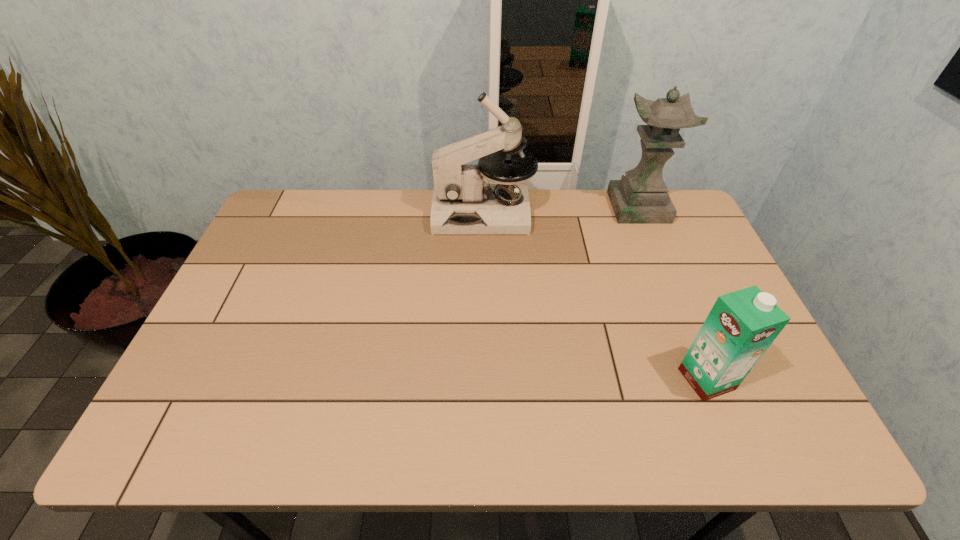
The height and width of the screenshot is (540, 960). Find the location of `vacant area at the near right corner of the desktop`. vacant area at the near right corner of the desktop is located at coordinates (731, 423).

Identify the location of free space between the leftmost object and the shortest object. point(595,296).

Image resolution: width=960 pixels, height=540 pixels. I want to click on vacant space that's between the leftmost object and the shortest object, so click(595, 296).

Locate an element on the screen. This screenshot has height=540, width=960. free point between the sculpture and the shortest object is located at coordinates (672, 293).

Where is `empty space between the nearest object and the sculpture`? The image size is (960, 540). empty space between the nearest object and the sculpture is located at coordinates coord(672,293).

This screenshot has width=960, height=540. What are the coordinates of `vacant area that lies between the sculpture and the carton` in the screenshot? It's located at (672, 293).

Identify the location of vacant point located between the leftmost object and the nearest object. (595, 296).

This screenshot has height=540, width=960. What are the coordinates of `empty space between the sculpture and the carton` in the screenshot? It's located at (x=672, y=293).

I want to click on empty location between the microscope and the nearest object, so click(x=595, y=296).

In order to click on unoccupied area between the carton and the sculpture in this screenshot , I will do `click(672, 293)`.